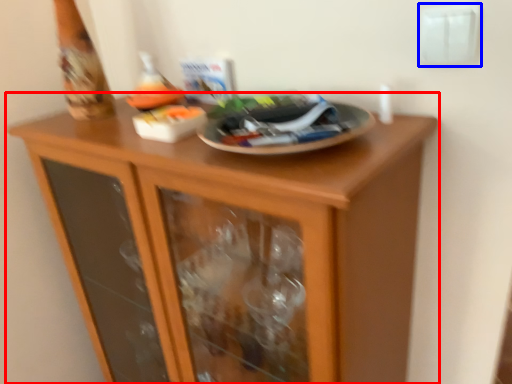
Question: Which of the following is the farthest to the observer, cupboard (highlighted by a red box) or electric outlet (highlighted by a blue box)?

Choices:
 (A) cupboard
 (B) electric outlet

Answer: (B)